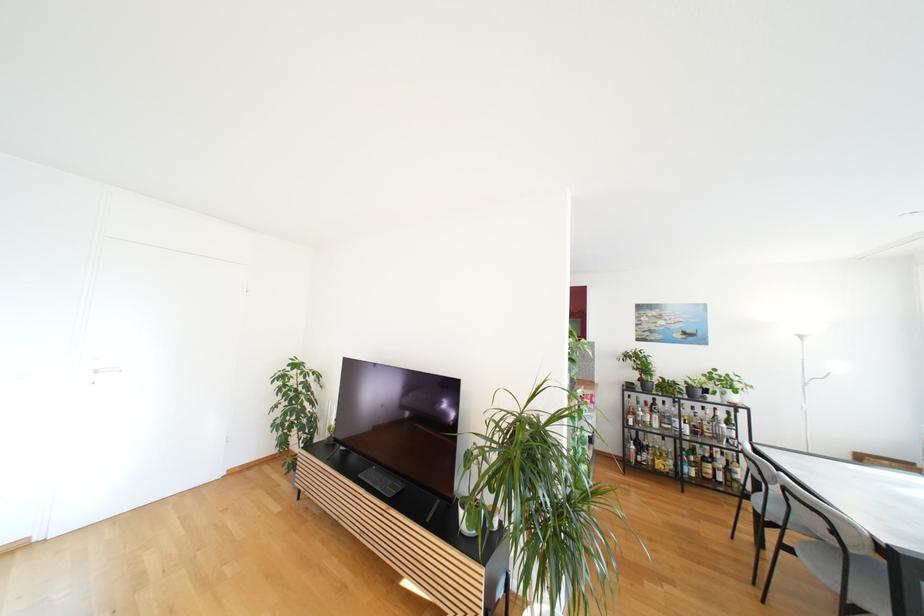
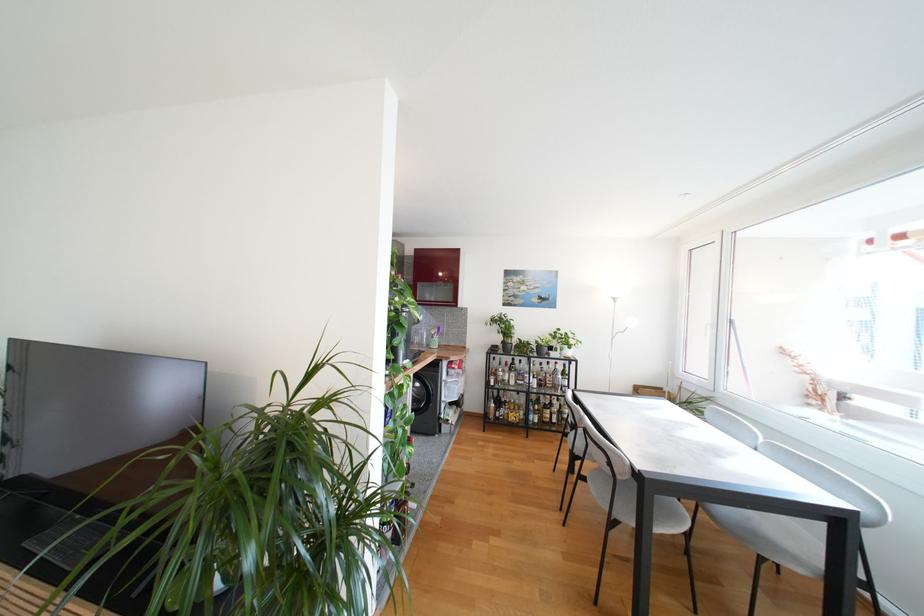
Locate, in the second image, the point that corresponds to point 654,426 in the first image.

(513, 383)